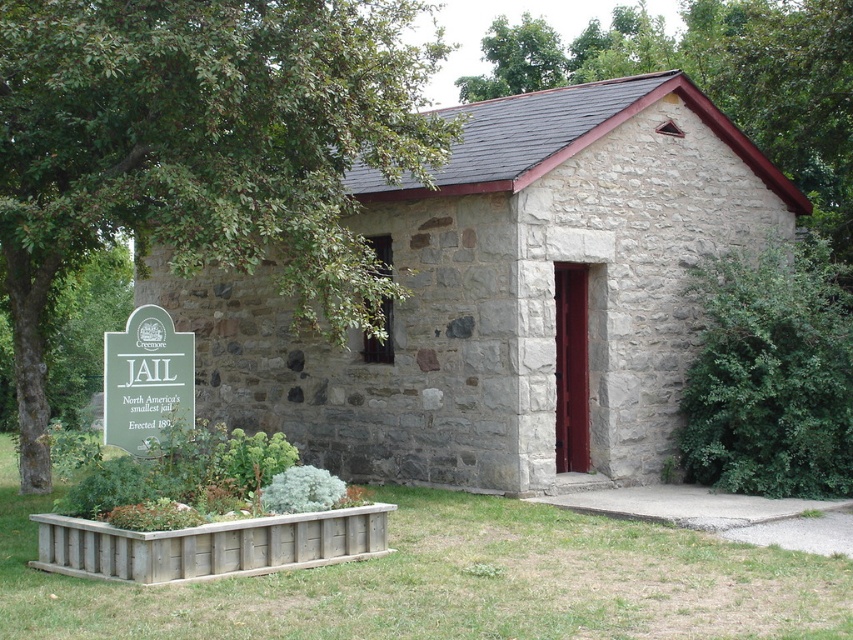
Question: Is green leafy tree at upper center thinner than green leafy bush at right?

Choices:
 (A) yes
 (B) no

Answer: (B)

Question: Can you confirm if green leafy tree at upper left is positioned to the right of green leafy tree at upper center?

Choices:
 (A) yes
 (B) no

Answer: (B)

Question: Estimate the real-world distances between objects in this image. Which object is farther from the gray stone building at center?

Choices:
 (A) green leafy bush at right
 (B) green leafy tree at upper center

Answer: (B)

Question: Among these points, which one is nearest to the camera?

Choices:
 (A) (360, 282)
 (B) (614, 51)

Answer: (A)

Question: Which point is farther to the camera?

Choices:
 (A) green leafy tree at upper left
 (B) gray stone building at center
 (C) green leafy tree at upper center
 (D) green leafy bush at right

Answer: (C)

Question: Does gray stone building at center have a smaller size compared to green leafy bush at right?

Choices:
 (A) yes
 (B) no

Answer: (A)